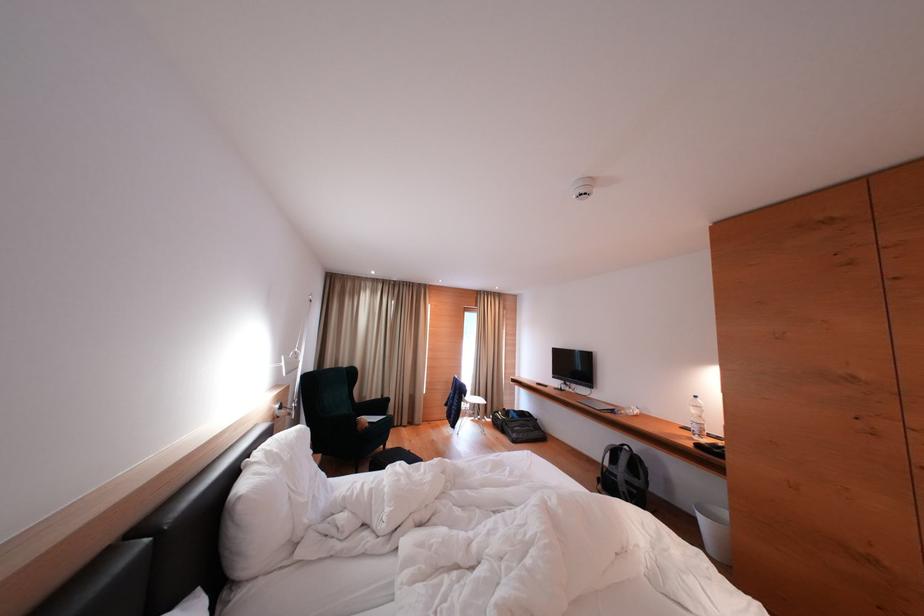
Identify the location of white lamp switch. The height and width of the screenshot is (616, 924). (275, 410).